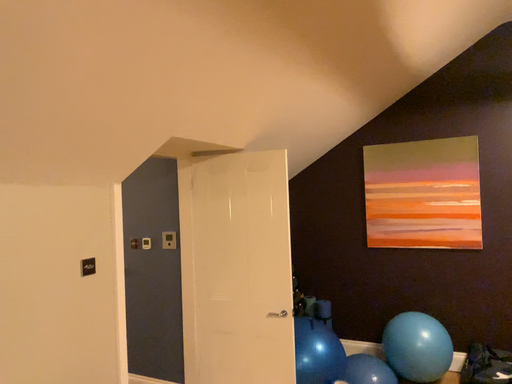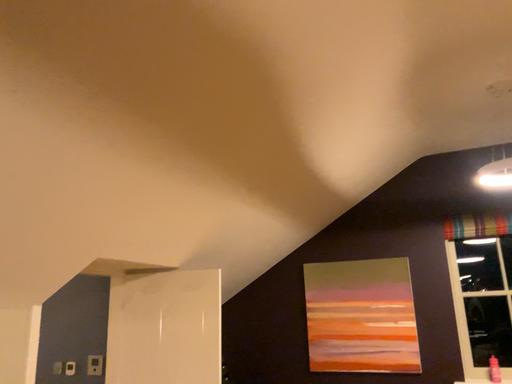
Question: How did the camera likely rotate when shooting the video?

Choices:
 (A) rotated upward
 (B) rotated downward

Answer: (A)